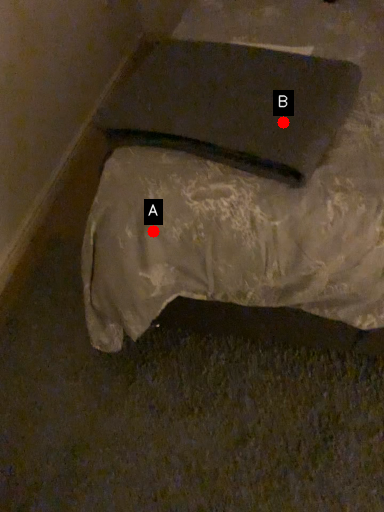
Question: Two points are circled on the image, labeled by A and B beside each circle. Among these points, which one is nearest to the camera?

Choices:
 (A) A is closer
 (B) B is closer

Answer: (B)